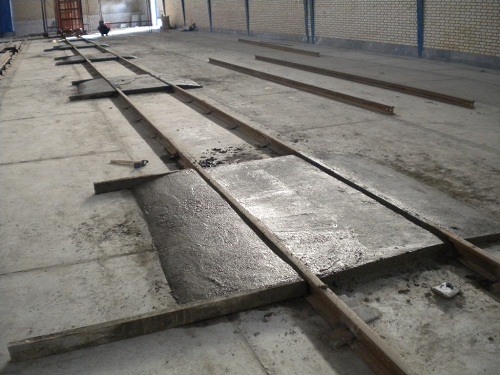
Where is `light reflection from ceiling`? This screenshot has width=500, height=375. light reflection from ceiling is located at coordinates (273, 214).